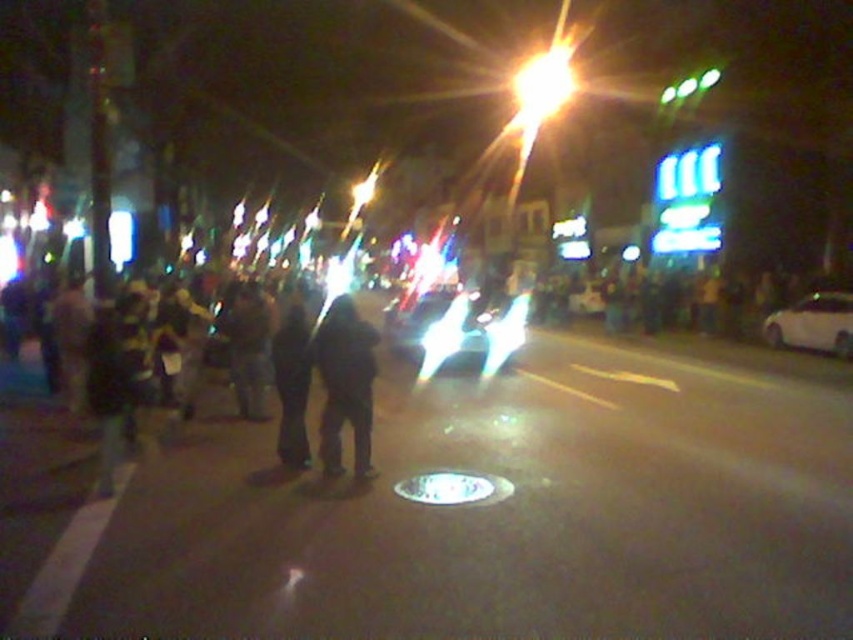
You are a photographer standing at the camera position. You want to capture a clear photo of the black matte jacket at center. Considering the current distance, is it advisable to use a telephoto lens to zoom in?

The black matte jacket at center is 23.24 feet away from the camera. Using a telephoto lens would allow you to zoom in and capture a clear image of the jacket despite the distance.

From the picture: You are a photographer trying to capture a clear image of the black matte jacket at center and the black matte crowd at left. Since the scene is dimly lit, you need to adjust your camera settings. Which object should you focus on first to ensure proper exposure, considering their sizes?

The black matte jacket at center is taller than the black matte crowd at left, so focusing on the larger object first might help balance the exposure. However, since both are dark and in low light, using a higher ISO or wider aperture could improve the shot.

You are standing at the point labeled point [813,316] and want to walk to the point labeled point [323,460]. Given the nighttime urban scene described, will you have to move forward or backward to reach your destination?

Since point [323,460] is in front of point [813,316], you will need to move forward to reach it.